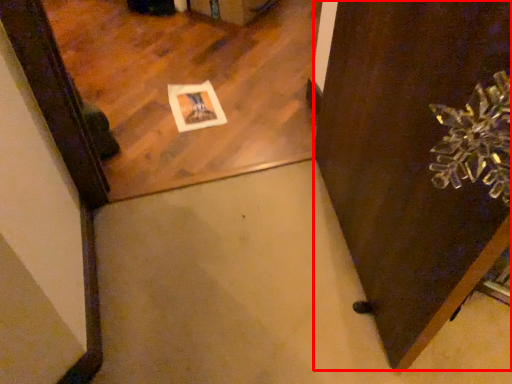
Question: From the image's perspective, where is door (annotated by the red box) located in relation to mirror in the image?

Choices:
 (A) below
 (B) above

Answer: (A)